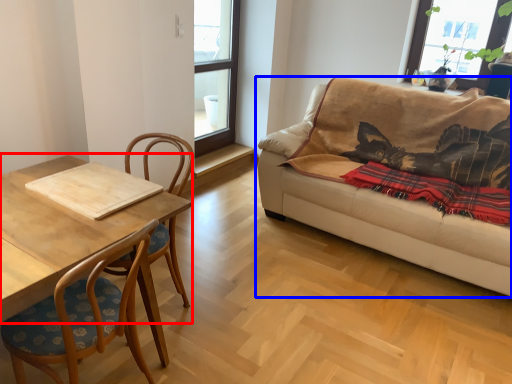
Question: Which object appears farthest to the camera in this image, coffee table (highlighted by a red box) or studio couch (highlighted by a blue box)?

Choices:
 (A) coffee table
 (B) studio couch

Answer: (B)